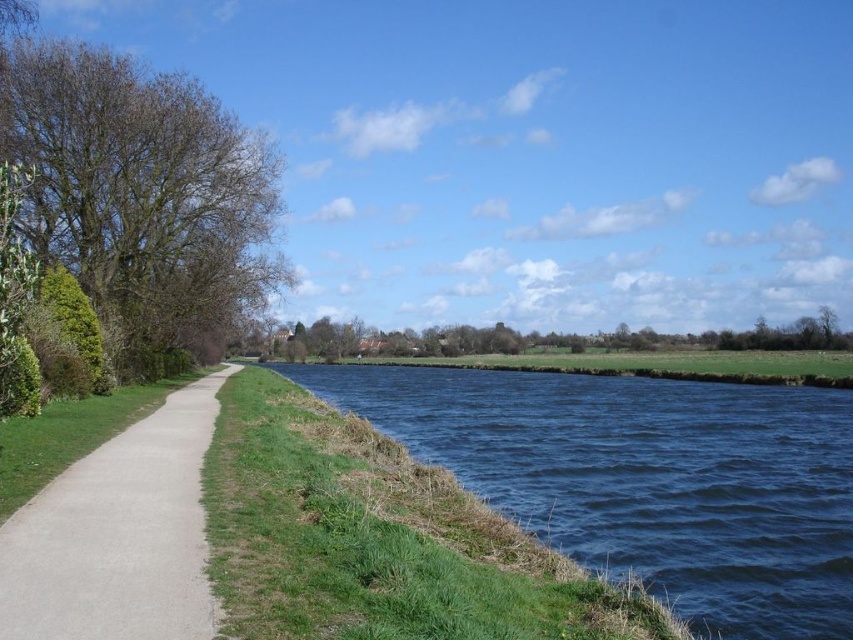
Between blue water at center and gray concrete path at left, which one is positioned lower?

blue water at center is lower down.

Does point (670, 532) lie in front of point (161, 588)?

No.

Identify the location of blue water at center. (645, 480).

Identify the location of blue water at center. (645, 480).

Who is taller, blue water at center or green leafy tree at left?

green leafy tree at left is taller.

Where is `blue water at center`? blue water at center is located at coordinates coord(645,480).

Does gray concrete path at left have a lesser width compared to green leafy tree at center?

Correct, gray concrete path at left's width is less than green leafy tree at center's.

Between point (165, 490) and point (434, 355), which one is positioned in front?

Positioned in front is point (165, 490).

Is point (83, 508) positioned after point (476, 339)?

No, it is in front of (476, 339).

Identify the location of gray concrete path at left. This screenshot has width=853, height=640. (119, 536).